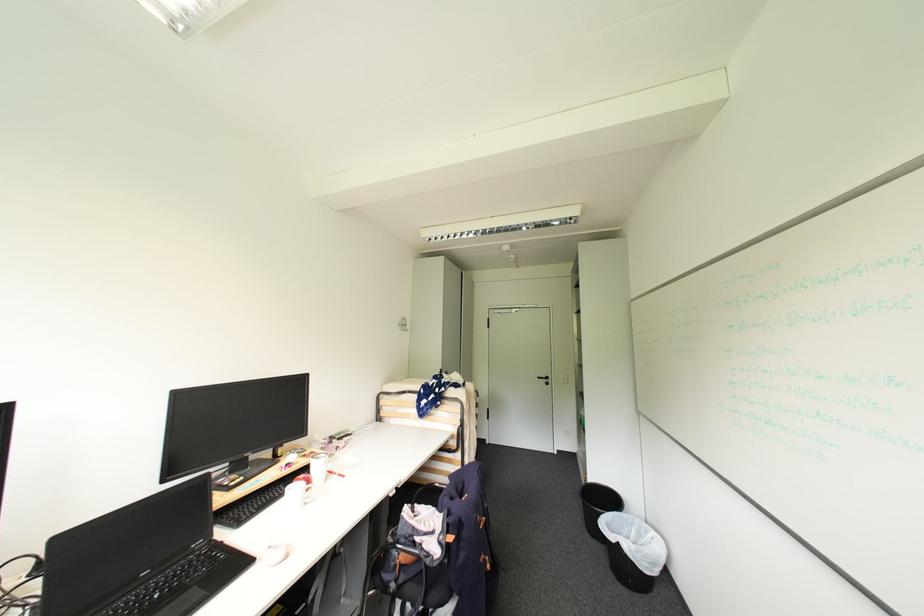
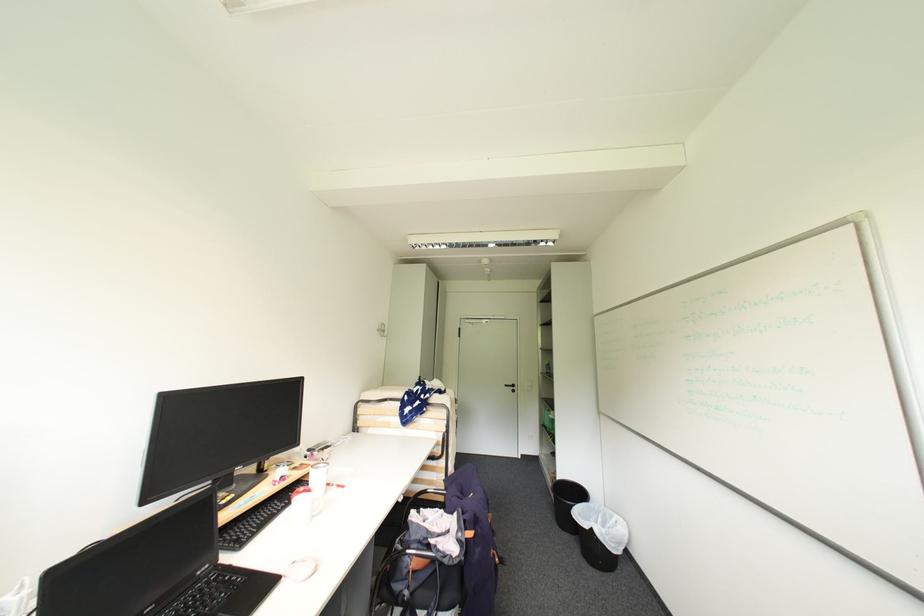
The point at (276, 548) is marked in the first image. Where is the corresponding point in the second image?

(300, 564)